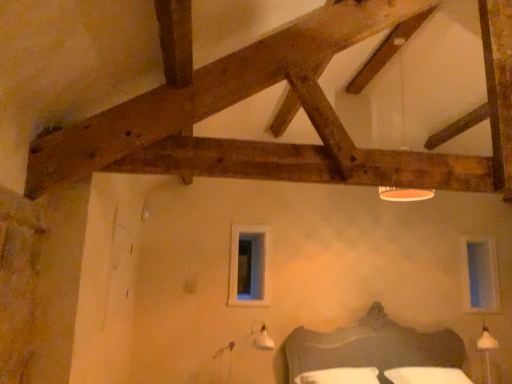
This screenshot has width=512, height=384. Find the location of `white plastic lampshade at upper center`. white plastic lampshade at upper center is located at coordinates (404, 194).

Where is `white cotton bedding at lower center`? This screenshot has width=512, height=384. white cotton bedding at lower center is located at coordinates (426, 375).

The image size is (512, 384). Find the location of `clear glass window at center, the 1th window viewed from the front`. clear glass window at center, the 1th window viewed from the front is located at coordinates (249, 266).

Is white cotton bedding at lower center spatially inside white plastic lampshade at upper center, or outside of it?

white cotton bedding at lower center is not inside white plastic lampshade at upper center, it's outside.

From the image's perspective, is white cotton bedding at lower center beneath white plastic lampshade at upper center?

Yes.

Consider the image. Which is more to the left, white cotton bedding at lower center or white plastic lampshade at upper center?

white cotton bedding at lower center.

Where is `lamp that appears on the right of white cotton bedding at lower center`? The image size is (512, 384). lamp that appears on the right of white cotton bedding at lower center is located at coordinates (404, 194).

From a real-world perspective, which object stands above the other?

From a 3D spatial view, clear glass window at center, the 1th window viewed from the front, is above.

Who is shorter, clear glass window at center, the second window from the right, or clear glass window at upper right, which appears as the first window when viewed from the right?

Standing shorter between the two is clear glass window at center, the second window from the right.

Is clear glass window at center, which is counted as the 2th window, starting from the back, not close to clear glass window at upper right, which is the second window from front to back?

Indeed, clear glass window at center, which is counted as the 2th window, starting from the back, is not near clear glass window at upper right, which is the second window from front to back.

At what (x,y) coordinates should I click in order to perform the action: click on window that appears on the left of dark gray wooden bed at lower center. Please return your answer as a coordinate pair (x, y). Looking at the image, I should click on (249, 266).

Is clear glass window at center, the second window from the right, facing towards dark gray wooden bed at lower center?

No, clear glass window at center, the second window from the right, is not facing towards dark gray wooden bed at lower center.

Is clear glass window at center, which is the first window from left to right, far from dark gray wooden bed at lower center?

They are positioned close to each other.

From the picture: Considering the relative positions of clear glass window at center, the second window from the right, and dark gray wooden bed at lower center in the image provided, is clear glass window at center, the second window from the right, behind dark gray wooden bed at lower center?

That is True.

Between point (250, 259) and point (403, 81), which one is positioned in front?

Point (403, 81)

Can you confirm if clear glass window at center, the second window from the right, is positioned to the left of white plastic lampshade at upper center?

Yes.

Based on the photo, from a real-world perspective, is clear glass window at center, which is counted as the 2th window, starting from the back, physically above white plastic lampshade at upper center?

No, from a real-world perspective, clear glass window at center, which is counted as the 2th window, starting from the back, is not over white plastic lampshade at upper center

Is clear glass window at center, which is counted as the 2th window, starting from the back, not inside white plastic lampshade at upper center?

Indeed, clear glass window at center, which is counted as the 2th window, starting from the back, is completely outside white plastic lampshade at upper center.

From a real-world perspective, who is located higher, white cotton bedding at lower center or dark gray wooden bed at lower center?

dark gray wooden bed at lower center, from a real-world perspective.

How different are the orientations of white cotton bedding at lower center and dark gray wooden bed at lower center in degrees?

The facing directions of white cotton bedding at lower center and dark gray wooden bed at lower center are 0.000636 degrees apart.

Which object is positioned more to the left, white cotton bedding at lower center or dark gray wooden bed at lower center?

From the viewer's perspective, white cotton bedding at lower center appears more on the left side.

Would you say white plastic lampshade at upper center is to the left or to the right of white cotton bedding at lower center in the picture?

In the image, white plastic lampshade at upper center appears on the right side of white cotton bedding at lower center.

Considering the sizes of objects white plastic lampshade at upper center and white cotton bedding at lower center in the image provided, who is thinner, white plastic lampshade at upper center or white cotton bedding at lower center?

white plastic lampshade at upper center is thinner.

In terms of height, does clear glass window at upper right, which is the 1th window in back-to-front order, look taller or shorter compared to clear glass window at center, which is the first window from left to right?

Clearly, clear glass window at upper right, which is the 1th window in back-to-front order, is taller compared to clear glass window at center, which is the first window from left to right.

Considering the sizes of objects clear glass window at upper right, which is the 1th window in back-to-front order, and clear glass window at center, which is counted as the 2th window, starting from the back, in the image provided, who is bigger, clear glass window at upper right, which is the 1th window in back-to-front order, or clear glass window at center, which is counted as the 2th window, starting from the back,?

clear glass window at upper right, which is the 1th window in back-to-front order.

Considering the relative positions of clear glass window at upper right, acting as the 2th window starting from the left, and clear glass window at center, which is counted as the 2th window, starting from the back, in the image provided, is clear glass window at upper right, acting as the 2th window starting from the left, to the left of clear glass window at center, which is counted as the 2th window, starting from the back, from the viewer's perspective?

No.

Where is `bedding below the white plastic lampshade at upper center (from the image's perspective)`? bedding below the white plastic lampshade at upper center (from the image's perspective) is located at coordinates (426, 375).

Find the location of a particular element. The width and height of the screenshot is (512, 384). window that is in front of the clear glass window at upper right, which is the 1th window in back-to-front order is located at coordinates (249, 266).

Which object lies nearer to the anchor point white cotton bedding at lower center, white plastic lampshade at upper center or clear glass window at center, which is the first window from left to right?

Among the two, clear glass window at center, which is the first window from left to right, is located nearer to white cotton bedding at lower center.

From the image, which object appears to be farther from clear glass window at upper right, which is the second window from front to back, clear glass window at center, which is the first window from left to right, or dark gray wooden bed at lower center?

The object further to clear glass window at upper right, which is the second window from front to back, is clear glass window at center, which is the first window from left to right.

Based on their spatial positions, is clear glass window at upper right, which is the second window from front to back, or white cotton bedding at lower center closer to clear glass window at center, the 1th window viewed from the front?

white cotton bedding at lower center.

Based on their spatial positions, is dark gray wooden bed at lower center or clear glass window at center, the second window from the right, further from white cotton bedding at lower center?

clear glass window at center, the second window from the right, is positioned further to the anchor white cotton bedding at lower center.

Which object lies further to the anchor point dark gray wooden bed at lower center, white plastic lampshade at upper center or white cotton bedding at lower center?

Based on the image, white plastic lampshade at upper center appears to be further to dark gray wooden bed at lower center.

Looking at the image, which one is located closer to white plastic lampshade at upper center, clear glass window at center, which is the first window from left to right, or white cotton bedding at lower center?

clear glass window at center, which is the first window from left to right.

Based on their spatial positions, is white plastic lampshade at upper center or white cotton bedding at lower center closer to clear glass window at center, the second window from the right?

The object closer to clear glass window at center, the second window from the right, is white cotton bedding at lower center.

Looking at the image, which one is located closer to clear glass window at center, the second window from the right, white cotton bedding at lower center or white plastic lampshade at upper center?

Based on the image, white cotton bedding at lower center appears to be nearer to clear glass window at center, the second window from the right.

Identify the location of lamp between clear glass window at center, which is counted as the 2th window, starting from the back, and clear glass window at upper right, acting as the 2th window starting from the left. point(404,194).

Locate an element on the screen. The width and height of the screenshot is (512, 384). bed between white plastic lampshade at upper center and white cotton bedding at lower center in the vertical direction is located at coordinates (371, 347).

Find the location of a particular element. The width and height of the screenshot is (512, 384). bedding between dark gray wooden bed at lower center and clear glass window at upper right, which is the second window from front to back, in the front-back direction is located at coordinates (426, 375).

Where is `window between dark gray wooden bed at lower center and clear glass window at upper right, which is the second window from front to back, along the z-axis`? The image size is (512, 384). window between dark gray wooden bed at lower center and clear glass window at upper right, which is the second window from front to back, along the z-axis is located at coordinates tap(249, 266).